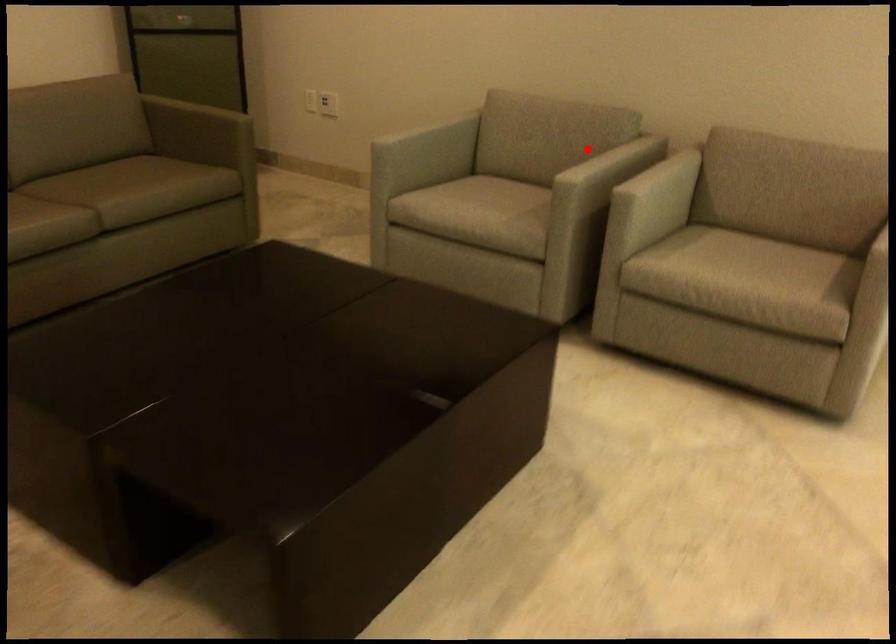
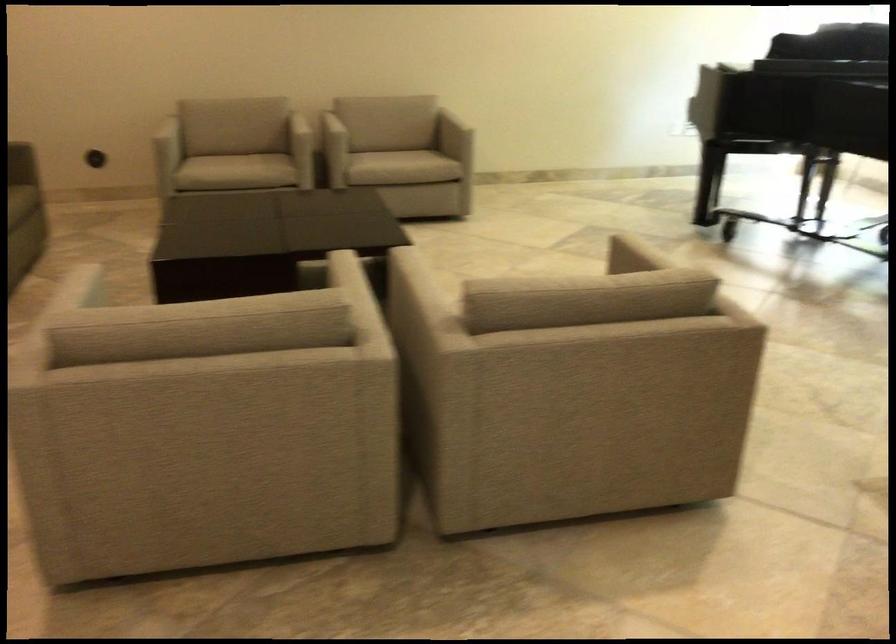
Question: I am providing you with two images of the same scene from different viewpoints. Given a red point in image1, look at the same physical point in image2. Is it:

Choices:
 (A) Closer to the viewpoint
 (B) Farther from the viewpoint

Answer: (B)